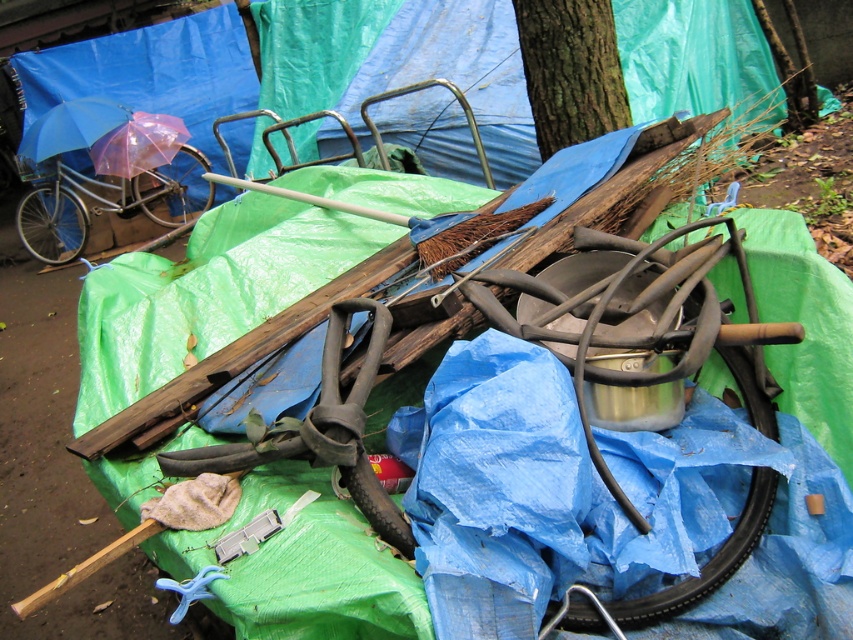
You are organizing the items in the scene. You need to move the transparent plastic umbrella at upper left and the blue matte umbrella at upper left to a storage area. Which umbrella should you move first to access the one behind it?

The blue matte umbrella at upper left is behind the transparent plastic umbrella at upper left, so you should move the transparent plastic umbrella at upper left first to access the one behind it.

You are organizing a garage sale and have two umbrellas to display. The transparent plastic umbrella at upper left and the blue matte umbrella at upper left are both hanging on a rack. Which umbrella has a thicker handle?

The blue matte umbrella at upper left has a thicker handle than the transparent plastic umbrella at upper left.

You are organizing the items on the tarpaulins and need to determine which umbrella is smaller. Which one is smaller between the transparent plastic umbrella at upper left and the blue matte umbrella at upper left?

The transparent plastic umbrella at upper left has a smaller size compared to the blue matte umbrella at upper left, so the transparent plastic umbrella at upper left is smaller.